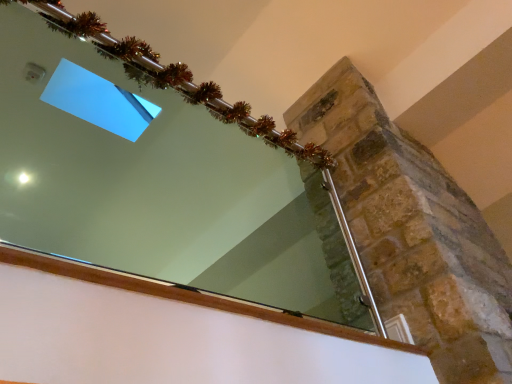
Describe the element at coordinates (162, 174) in the screenshot. I see `clear glass mirror at upper center` at that location.

Where is `clear glass mirror at upper center`? The height and width of the screenshot is (384, 512). clear glass mirror at upper center is located at coordinates (162, 174).

You are a GUI agent. You are given a task and a screenshot of the screen. Output one action in this format:
    pyautogui.click(x=<x>, y=<y>)
    Task: Click on the clear glass mirror at upper center
    The height and width of the screenshot is (384, 512).
    Given the screenshot: What is the action you would take?
    pyautogui.click(x=162, y=174)